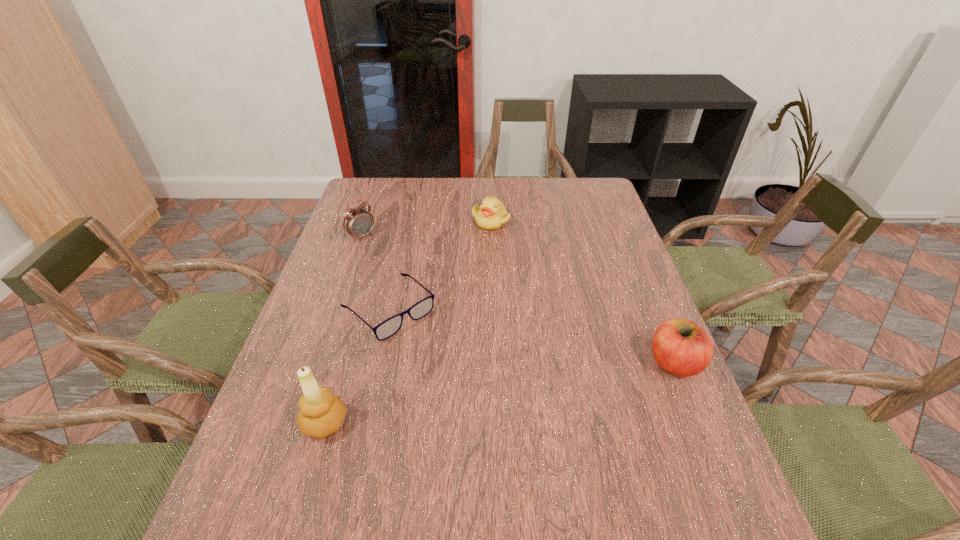
Image resolution: width=960 pixels, height=540 pixels. Find the location of `vacant point located between the rightmost object and the fourth tallest object`. vacant point located between the rightmost object and the fourth tallest object is located at coordinates (583, 292).

I want to click on free spot between the rightmost object and the second object from right to left, so click(583, 292).

The width and height of the screenshot is (960, 540). In order to click on free spot between the apple and the alarm clock in this screenshot , I will do `click(518, 300)`.

Identify the location of free space between the alarm clock and the fourth tallest object. The height and width of the screenshot is (540, 960). (426, 229).

The width and height of the screenshot is (960, 540). I want to click on free area in between the duckling and the spectacles, so click(440, 265).

You are a GUI agent. You are given a task and a screenshot of the screen. Output one action in this format:
    pyautogui.click(x=<x>, y=<y>)
    Task: Click on the vacant area that lies between the spectacles and the fourth tallest object
    This screenshot has width=960, height=540.
    Given the screenshot: What is the action you would take?
    pyautogui.click(x=440, y=265)

Where is `vacant space that is in between the candle_holder and the alarm clock`? vacant space that is in between the candle_holder and the alarm clock is located at coordinates (344, 330).

Locate an element on the screen. vacant region between the spectacles and the duckling is located at coordinates (440, 265).

Identify the location of free spot between the alarm clock and the second shortest object. The image size is (960, 540). (426, 229).

I want to click on vacant space that's between the second shortest object and the apple, so click(583, 292).